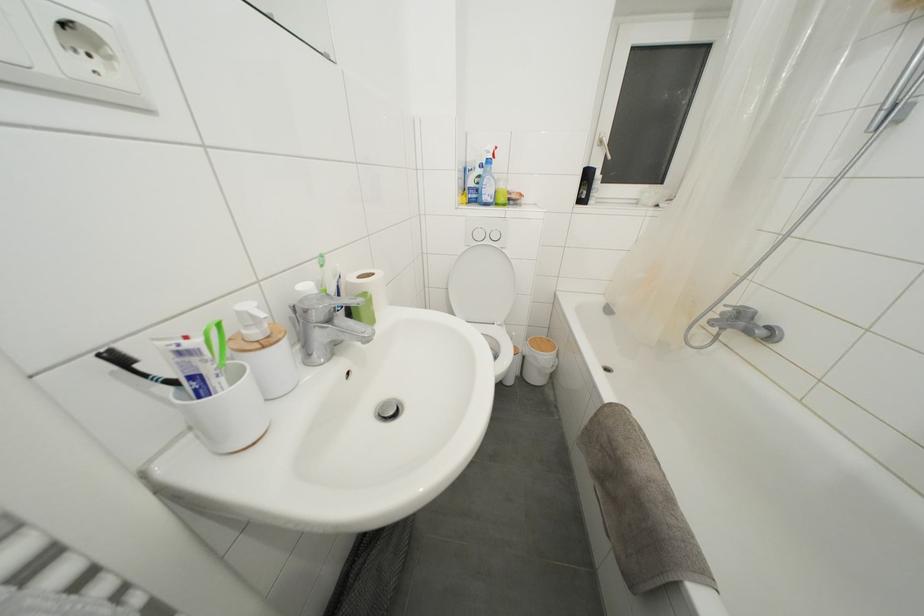
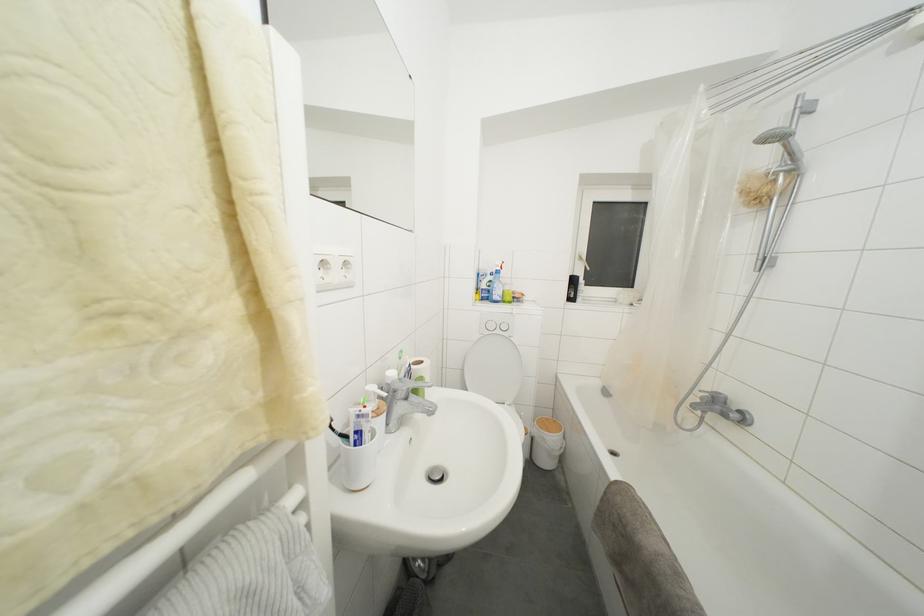
Locate, in the second image, the point that corresponds to (478,201) in the first image.

(490, 301)